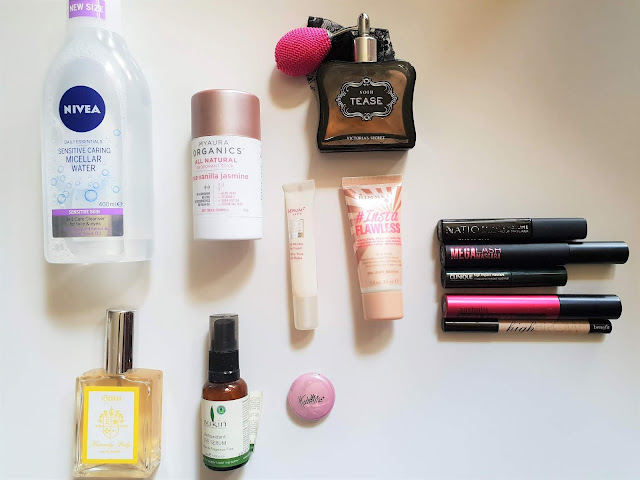
Find the location of a particular element. This screenshot has height=480, width=640. glass is located at coordinates (144, 389).